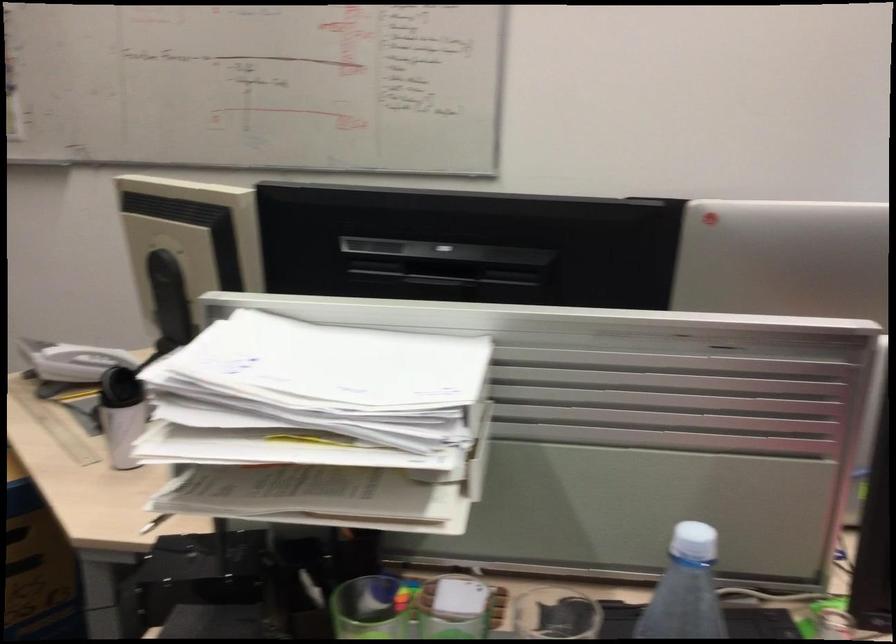
Identify the location of white telephone handset. (82, 362).